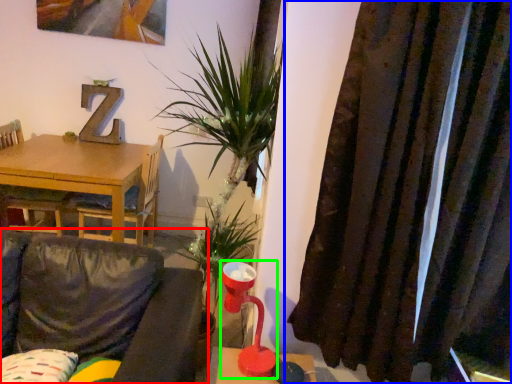
Question: Which object is positioned closest to studio couch (highlighted by a red box)? Select from curtain (highlighted by a blue box) and table lamp (highlighted by a green box).

Choices:
 (A) curtain
 (B) table lamp

Answer: (B)